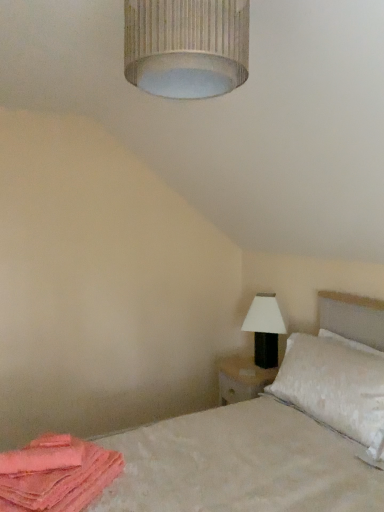
The image size is (384, 512). What do you see at coordinates (335, 385) in the screenshot?
I see `white textured pillow at right` at bounding box center [335, 385].

Find the location of `pink fabric at lower left`. pink fabric at lower left is located at coordinates (55, 474).

This screenshot has width=384, height=512. In order to click on white matte table lamp at right in this screenshot , I will do `click(265, 329)`.

Find the location of `white textured lampshade at upper center`. white textured lampshade at upper center is located at coordinates (186, 46).

Which object is further away from the camera, white textured pillow at right or white textured bed at lower right?

white textured pillow at right is more distant.

Consider the image. From the image's perspective, is white textured pillow at right located above or below white textured bed at lower right?

Based on their image positions, white textured pillow at right is located above white textured bed at lower right.

From a real-world perspective, is white textured pillow at right under white textured bed at lower right?

No, from a real-world perspective, white textured pillow at right is not under white textured bed at lower right.

Would you say white textured bed at lower right is part of white textured pillow at right's contents?

No.

Is white textured bed at lower right not within white textured lampshade at upper center?

white textured bed at lower right lies outside white textured lampshade at upper center's area.

Between white textured bed at lower right and white textured lampshade at upper center, which one is positioned behind?

white textured lampshade at upper center.

From a real-world perspective, which object rests below the other?

From a 3D spatial view, white textured bed at lower right is below.

Between white textured bed at lower right and white textured lampshade at upper center, which one has smaller width?

white textured lampshade at upper center is thinner.

Which of these two, white textured lampshade at upper center or pink fabric at lower left, is smaller?

pink fabric at lower left is smaller.

Image resolution: width=384 pixels, height=512 pixels. In order to click on lamp in front of the pink fabric at lower left in this screenshot , I will do `click(186, 46)`.

From the image's perspective, is white textured lampshade at upper center beneath pink fabric at lower left?

Incorrect, from the image's perspective, white textured lampshade at upper center is higher than pink fabric at lower left.

Can you confirm if white textured lampshade at upper center is wider than white textured pillow at right?

No, white textured lampshade at upper center is not wider than white textured pillow at right.

From the picture: Is white textured lampshade at upper center to the right of white textured pillow at right from the viewer's perspective?

No.

Can white textured pillow at right be found inside white textured lampshade at upper center?

No, white textured pillow at right is not inside white textured lampshade at upper center.

Could you tell me if white textured lampshade at upper center is facing white textured pillow at right?

No, white textured lampshade at upper center is not oriented towards white textured pillow at right.

Which object is wider, white textured pillow at right or white matte table lamp at right?

With larger width is white textured pillow at right.

Where is `table lamp above the white textured pillow at right (from a real-world perspective)`? The height and width of the screenshot is (512, 384). table lamp above the white textured pillow at right (from a real-world perspective) is located at coordinates (265, 329).

What's the angular difference between white textured pillow at right and white matte table lamp at right's facing directions?

white textured pillow at right and white matte table lamp at right are facing 0.000651 degrees away from each other.

Are white textured lampshade at upper center and white textured bed at lower right making contact?

No, white textured lampshade at upper center is not next to white textured bed at lower right.

From the image's perspective, relative to white textured bed at lower right, is white textured lampshade at upper center above or below?

Clearly, from the image's perspective, white textured lampshade at upper center is above white textured bed at lower right.

Is white textured lampshade at upper center facing towards white textured bed at lower right?

No, white textured lampshade at upper center is not facing towards white textured bed at lower right.

Consider the image. Which object is wider, pink fabric at lower left or white matte table lamp at right?

pink fabric at lower left.

Considering the sizes of objects pink fabric at lower left and white matte table lamp at right in the image provided, who is taller, pink fabric at lower left or white matte table lamp at right?

Standing taller between the two is white matte table lamp at right.

From the image's perspective, which object appears higher, pink fabric at lower left or white matte table lamp at right?

white matte table lamp at right is shown above in the image.

In the scene shown: From a real-world perspective, which object stands above the other?

white matte table lamp at right is physically above.

Image resolution: width=384 pixels, height=512 pixels. Identify the location of bed beneath the white textured pillow at right (from a real-world perspective). (240, 464).

Find the location of `bed on the right of white textured lampshade at upper center`. bed on the right of white textured lampshade at upper center is located at coordinates (240, 464).

Estimate the real-world distances between objects in this image. Which object is further from white textured pillow at right, white textured bed at lower right or white textured lampshade at upper center?

white textured lampshade at upper center lies further to white textured pillow at right than the other object.

Looking at this image, which object lies nearer to the anchor point white textured bed at lower right, pink fabric at lower left or white textured pillow at right?

white textured pillow at right.

Consider the image. Looking at the image, which one is located further to white matte table lamp at right, pink fabric at lower left or white textured pillow at right?

pink fabric at lower left is positioned further to the anchor white matte table lamp at right.

Estimate the real-world distances between objects in this image. Which object is further from white textured pillow at right, white textured bed at lower right or pink fabric at lower left?

pink fabric at lower left is positioned further to the anchor white textured pillow at right.

Based on their spatial positions, is white textured bed at lower right or white textured pillow at right closer to white matte table lamp at right?

Among the two, white textured pillow at right is located nearer to white matte table lamp at right.

When comparing their distances from pink fabric at lower left, does white textured pillow at right or white matte table lamp at right seem closer?

white textured pillow at right lies closer to pink fabric at lower left than the other object.

Which object lies nearer to the anchor point white textured bed at lower right, white matte table lamp at right or pink fabric at lower left?

Based on the image, pink fabric at lower left appears to be nearer to white textured bed at lower right.

When comparing their distances from white matte table lamp at right, does white textured pillow at right or white textured bed at lower right seem closer?

white textured pillow at right is closer to white matte table lamp at right.

This screenshot has width=384, height=512. What are the coordinates of `material between white textured bed at lower right and white textured pillow at right along the z-axis` in the screenshot? It's located at (55, 474).

You are a GUI agent. You are given a task and a screenshot of the screen. Output one action in this format:
    pyautogui.click(x=<x>, y=<y>)
    Task: Click on the lamp between white textured bed at lower right and white matte table lamp at right in the front-back direction
    
    Given the screenshot: What is the action you would take?
    pyautogui.click(x=186, y=46)

This screenshot has width=384, height=512. What are the coordinates of `pillow that lies between white textured lampshade at upper center and pink fabric at lower left from top to bottom` in the screenshot? It's located at (335, 385).

What are the coordinates of `pillow between white textured lampshade at upper center and white matte table lamp at right in the front-back direction` in the screenshot? It's located at (335, 385).